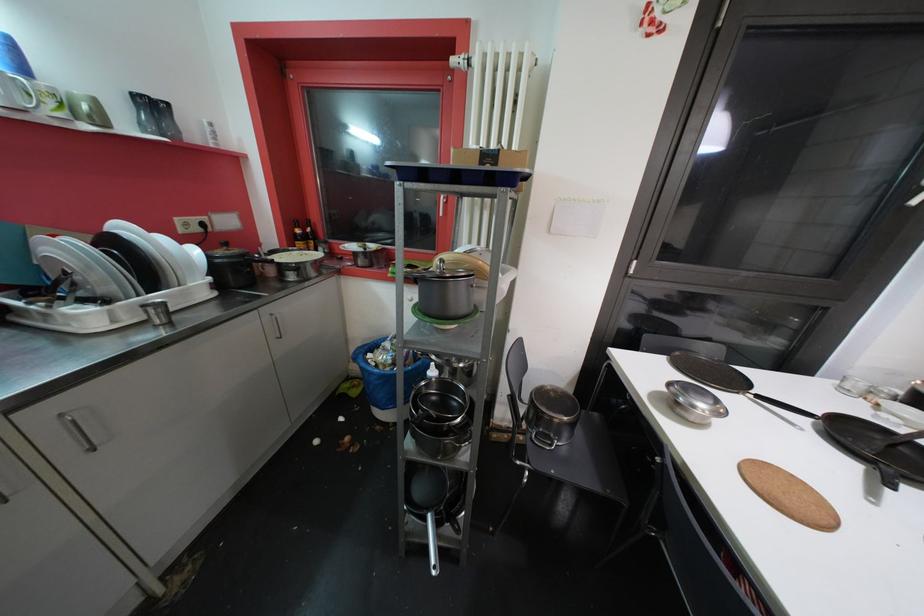
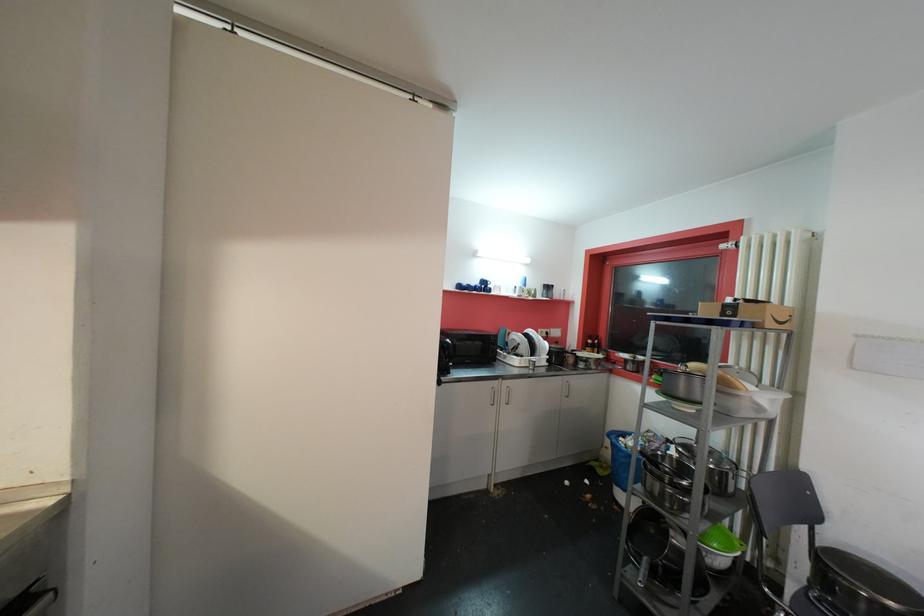
In the second image, find the point that corresponds to point 296,241 in the first image.

(590, 347)